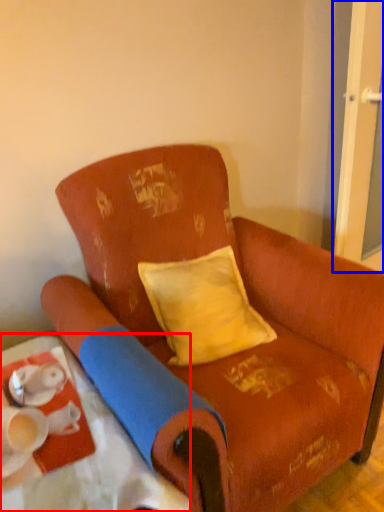
Question: Which object is further to the camera taking this photo, table (highlighted by a red box) or screen door (highlighted by a blue box)?

Choices:
 (A) table
 (B) screen door

Answer: (B)